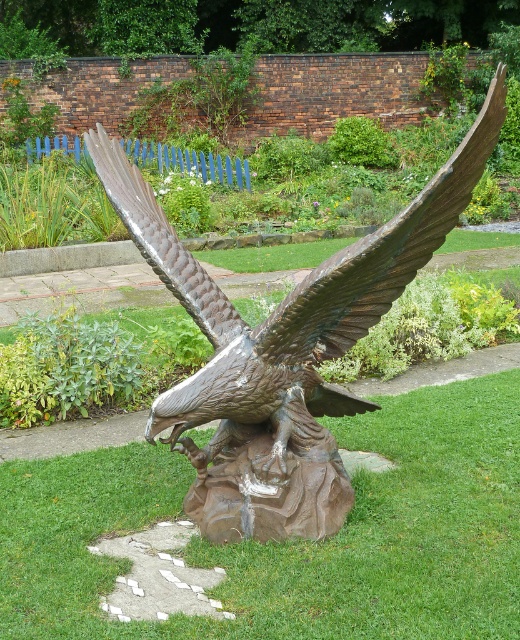
Question: Does green grass at center lie in front of bronze eagle at center?

Choices:
 (A) yes
 (B) no

Answer: (A)

Question: Which point is farther to the camera?

Choices:
 (A) green grass at center
 (B) bronze eagle at center

Answer: (B)

Question: Is bronze eagle at center wider than shiny bronze wing at upper center?

Choices:
 (A) no
 (B) yes

Answer: (B)

Question: Which of the following is the closest to the observer?

Choices:
 (A) shiny bronze wing at upper center
 (B) bronze eagle at center
 (C) green grass at center

Answer: (C)

Question: Among these objects, which one is nearest to the camera?

Choices:
 (A) green grass at center
 (B) bronze eagle at center

Answer: (A)

Question: Can you confirm if bronze eagle at center is positioned to the left of shiny bronze wing at upper center?

Choices:
 (A) yes
 (B) no

Answer: (B)